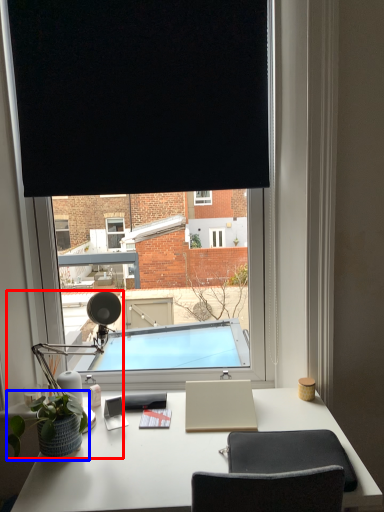
Question: Among these objects, which one is nearest to the camera, table lamp (highlighted by a red box) or houseplant (highlighted by a blue box)?

Choices:
 (A) table lamp
 (B) houseplant

Answer: (B)